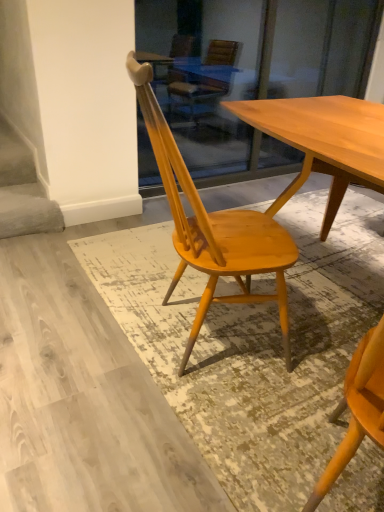
What are the coordinates of `light brown wood chair at center` in the screenshot? It's located at (213, 226).

Describe the element at coordinates (213, 226) in the screenshot. I see `light brown wood chair at center` at that location.

What is the approximate height of light brown wood chair at center?

The height of light brown wood chair at center is 97.68 centimeters.

This screenshot has height=512, width=384. In order to click on light brown wood chair at center in this screenshot , I will do `click(213, 226)`.